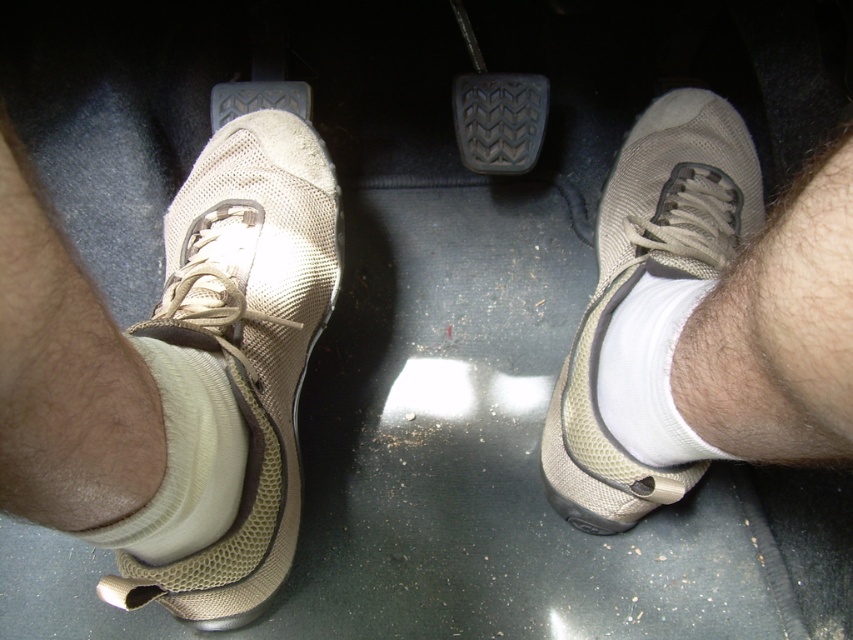
Can you confirm if tan mesh shoe at center is positioned to the right of white soft sock at center?

Indeed, tan mesh shoe at center is positioned on the right side of white soft sock at center.

Can you confirm if tan mesh shoe at center is bigger than white soft sock at center?

Indeed, tan mesh shoe at center has a larger size compared to white soft sock at center.

This screenshot has width=853, height=640. Find the location of `tan mesh shoe at center`. tan mesh shoe at center is located at coordinates (634, 282).

Which is in front, point (245, 493) or point (653, 404)?

Point (653, 404)

Is point (323, 180) more distant than point (653, 410)?

That is True.

Who is more forward, (242, 264) or (679, 288)?

Point (679, 288)

Find the location of a particular element. The width and height of the screenshot is (853, 640). tan mesh shoe at left is located at coordinates (245, 346).

Which is more to the left, tan mesh shoe at left or white fabric sock at lower left?

tan mesh shoe at left

Can you confirm if tan mesh shoe at left is positioned to the right of white fabric sock at lower left?

Incorrect, tan mesh shoe at left is not on the right side of white fabric sock at lower left.

I want to click on tan mesh shoe at left, so click(x=245, y=346).